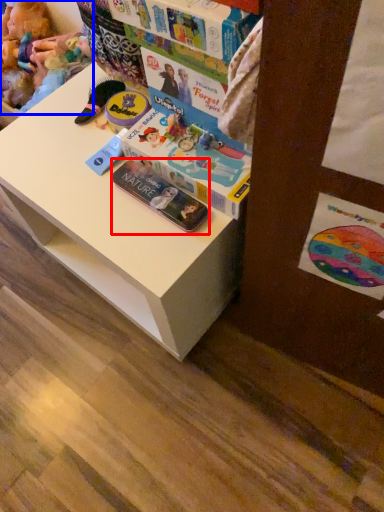
Question: Which object appears closest to the camera in this image, paperback book (highlighted by a red box) or toy (highlighted by a blue box)?

Choices:
 (A) paperback book
 (B) toy

Answer: (A)